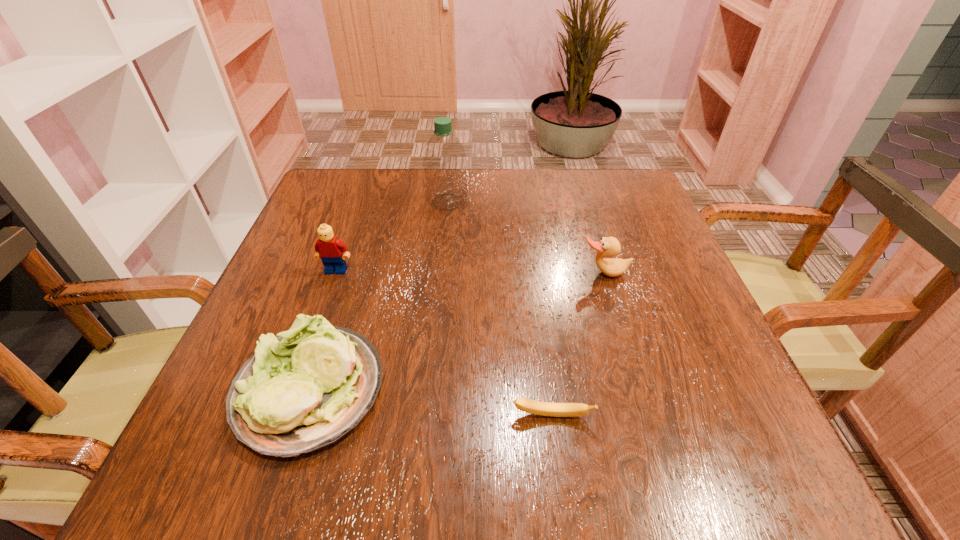
Locate an element on the screen. This screenshot has height=540, width=960. free space at the left edge of the desktop is located at coordinates (293, 273).

In the image, there is a desktop. Find the location of `vacant space at the right edge`. vacant space at the right edge is located at coordinates (690, 404).

Where is `free space at the far left corner of the desktop`? free space at the far left corner of the desktop is located at coordinates click(365, 173).

Image resolution: width=960 pixels, height=540 pixels. In order to click on free space between the duck and the lettuce in this screenshot , I will do [457, 332].

Where is `free space between the Lego and the farthest object`? free space between the Lego and the farthest object is located at coordinates (392, 236).

In order to click on free space between the lettuce and the water bottle in this screenshot , I will do `click(379, 296)`.

I want to click on empty space between the tallest object and the lettuce, so click(x=379, y=296).

Identify the location of vacant area that lies between the third object from left to right and the lettuce. The width and height of the screenshot is (960, 540). (379, 296).

Where is `vacant area that lies between the lettuce and the water bottle`? vacant area that lies between the lettuce and the water bottle is located at coordinates (379, 296).

Locate an element on the screen. The width and height of the screenshot is (960, 540). vacant space in between the duck and the fourth shortest object is located at coordinates (470, 272).